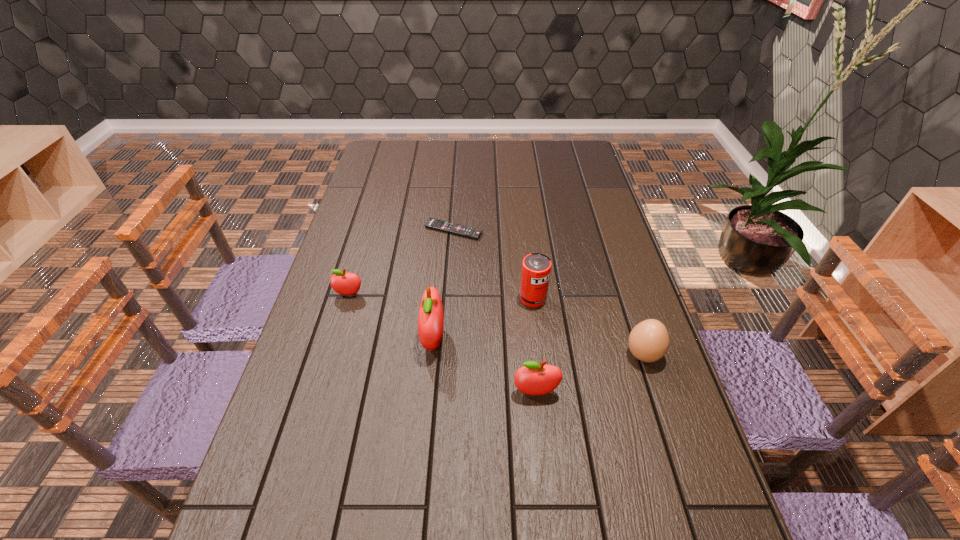
In order to click on the farthest apple in this screenshot , I will do `click(343, 283)`.

What are the coordinates of `the leftmost apple` in the screenshot? It's located at (343, 283).

At what (x,y) coordinates should I click in order to perform the action: click on the second apple from left to right. Please return your answer as a coordinate pair (x, y). The image size is (960, 540). Looking at the image, I should click on (431, 317).

You are a GUI agent. You are given a task and a screenshot of the screen. Output one action in this format:
    pyautogui.click(x=<x>, y=<y>)
    Task: Click on the second nearest apple
    
    Given the screenshot: What is the action you would take?
    coord(431,317)

You are a GUI agent. You are given a task and a screenshot of the screen. Output one action in this format:
    pyautogui.click(x=<x>, y=<y>)
    Task: Click on the rightmost apple
    The image size is (960, 540).
    Given the screenshot: What is the action you would take?
    pyautogui.click(x=533, y=378)

At what (x,y) coordinates should I click in order to perform the action: click on the second tallest apple. Please return your answer as a coordinate pair (x, y). Looking at the image, I should click on (533, 378).

Locate an element on the screen. The width and height of the screenshot is (960, 540). can is located at coordinates (536, 268).

Find the location of a particular element. The width and height of the screenshot is (960, 540). the rightmost object is located at coordinates (648, 341).

Identify the location of remote control. (461, 230).

Find the location of a particular element. the farthest object is located at coordinates (461, 230).